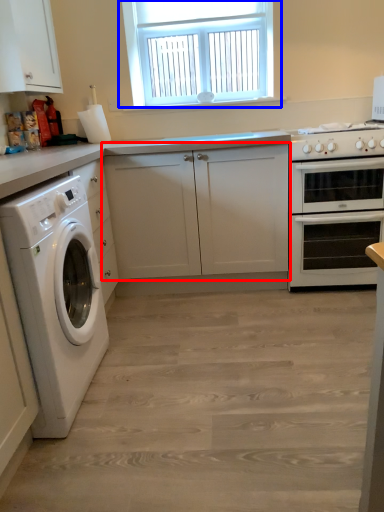
Question: Which object is further to the camera taking this photo, cabinetry (highlighted by a red box) or window (highlighted by a blue box)?

Choices:
 (A) cabinetry
 (B) window

Answer: (B)